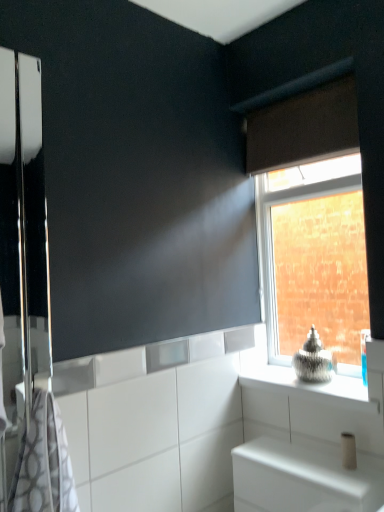
This screenshot has height=512, width=384. I want to click on free space to the back side of white matte toilet paper at lower right, so click(314, 453).